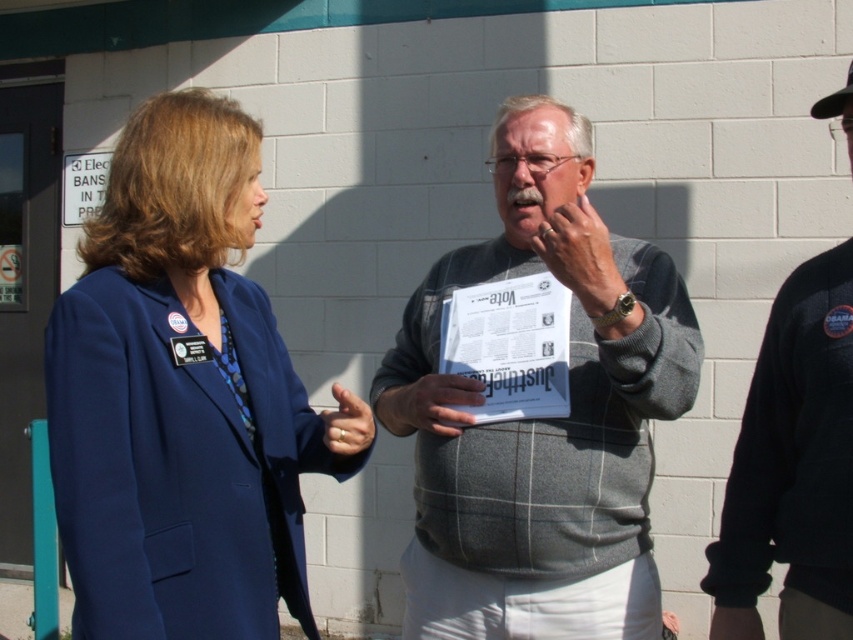
Can you confirm if blue fabric jacket at center is smaller than gray plaid sweater at center?

Correct, blue fabric jacket at center occupies less space than gray plaid sweater at center.

Which is below, blue fabric jacket at center or gray plaid sweater at center?

Positioned lower is gray plaid sweater at center.

Who is more distant from viewer, (90, 368) or (631, 448)?

The point (631, 448) is more distant.

The image size is (853, 640). I want to click on blue fabric jacket at center, so click(183, 397).

Is point (157, 516) closer to camera compared to point (838, 490)?

Yes, point (157, 516) is closer to viewer.

Is blue fabric jacket at center above black fleece jacket at right?

Yes.

Image resolution: width=853 pixels, height=640 pixels. Identify the location of blue fabric jacket at center. (183, 397).

This screenshot has width=853, height=640. I want to click on blue fabric jacket at center, so click(x=183, y=397).

Is gray plaid sweater at center smaller than black fleece jacket at right?

Incorrect, gray plaid sweater at center is not smaller in size than black fleece jacket at right.

Does gray plaid sweater at center have a lesser width compared to black fleece jacket at right?

No.

What do you see at coordinates (543, 419) in the screenshot? I see `gray plaid sweater at center` at bounding box center [543, 419].

Identify the location of gray plaid sweater at center. [x=543, y=419].